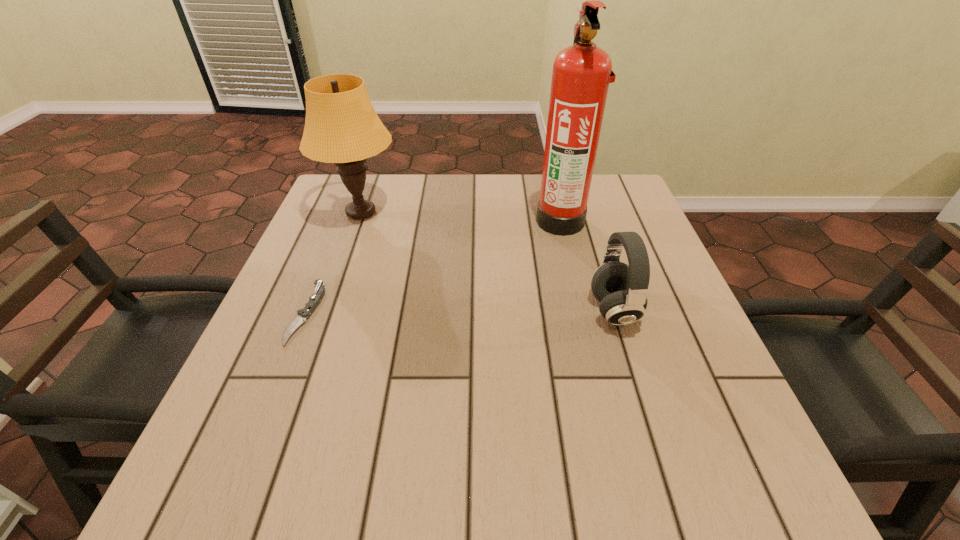
The width and height of the screenshot is (960, 540). Identify the location of the tallest object. point(582,72).

Find the location of a particular element. The height and width of the screenshot is (540, 960). lampshade is located at coordinates tap(341, 126).

Where is `the third tallest object`? The height and width of the screenshot is (540, 960). the third tallest object is located at coordinates (622, 290).

Locate an element on the screen. pocketknife is located at coordinates (314, 300).

Identify the location of vacant region located 0.280m with the nozzle pointing from the back of the tallest object. (426, 220).

Where is `free space located 0.380m with the nozzle pointing from the back of the tallest object`? The image size is (960, 540). free space located 0.380m with the nozzle pointing from the back of the tallest object is located at coordinates (387, 220).

At what (x,y) coordinates should I click in order to perform the action: click on free spot located 0.330m with the nozzle pointing from the back of the tallest object. Please return your answer as a coordinate pair (x, y). Looking at the image, I should click on (406, 220).

Find the location of a particular element. vacant space located 0.400m on the right of the second tallest object is located at coordinates (555, 212).

In order to click on free space located on the ear cups of the third tallest object in this screenshot , I will do (x=476, y=310).

This screenshot has width=960, height=540. I want to click on vacant space located 0.220m on the ear cups of the third tallest object, so click(481, 310).